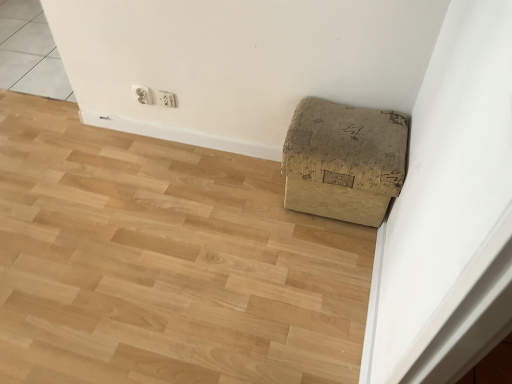
Identify the location of blank space situated above brown cardboard box at lower right (from a real-world perspective). The image size is (512, 384). (119, 175).